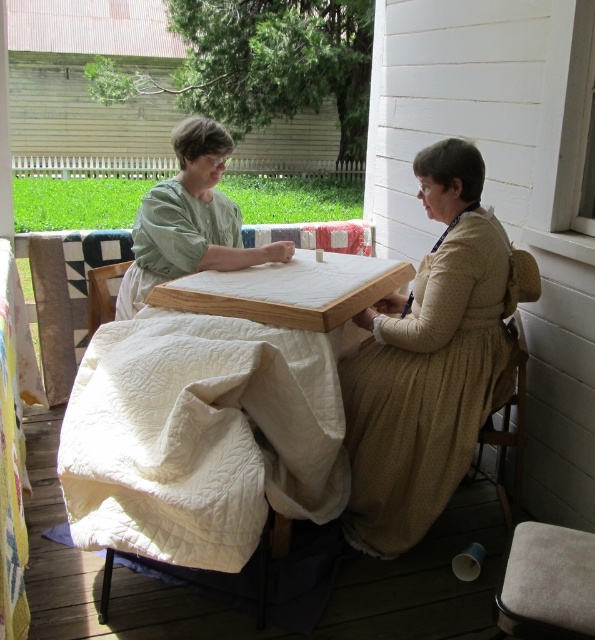
Question: Which point is closer to the camera?

Choices:
 (A) white quilted cloth at center
 (B) light brown cotton dress at center

Answer: (A)

Question: Can you confirm if light brown cotton dress at center is bigger than green matte fabric at center?

Choices:
 (A) no
 (B) yes

Answer: (B)

Question: Can you confirm if green matte fabric at center is positioned to the right of wooden table at center?

Choices:
 (A) no
 (B) yes

Answer: (A)

Question: Among these objects, which one is farthest from the camera?

Choices:
 (A) white quilted fabric at left
 (B) wooden table at center
 (C) green matte fabric at center
 (D) light brown cotton dress at center

Answer: (C)

Question: Is white quilted cloth at center closer to the viewer compared to white quilted fabric at left?

Choices:
 (A) yes
 (B) no

Answer: (B)

Question: Estimate the real-world distances between objects in this image. Which object is closer to the light brown cotton dress at center?

Choices:
 (A) green matte fabric at center
 (B) white quilted cloth at center
 (C) white quilted fabric at left

Answer: (B)